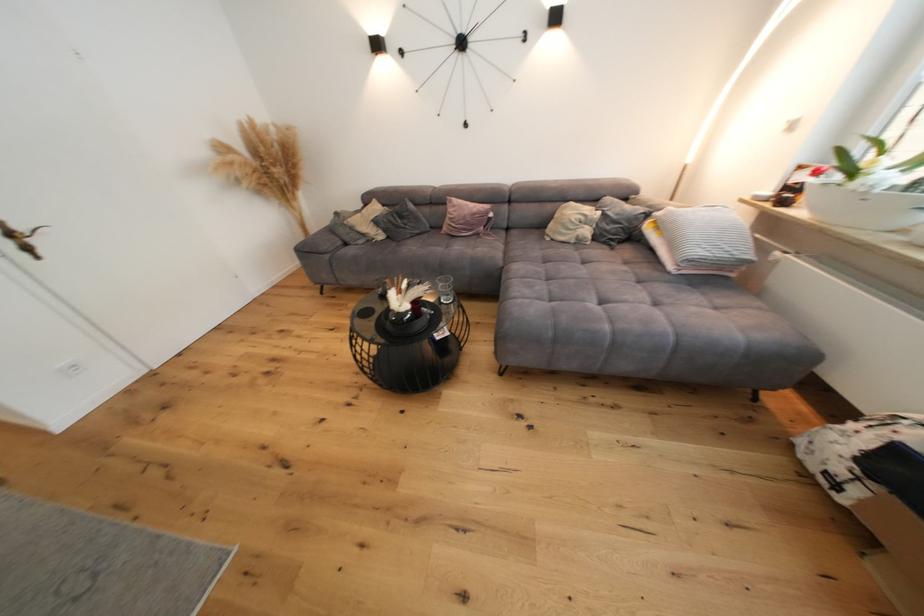
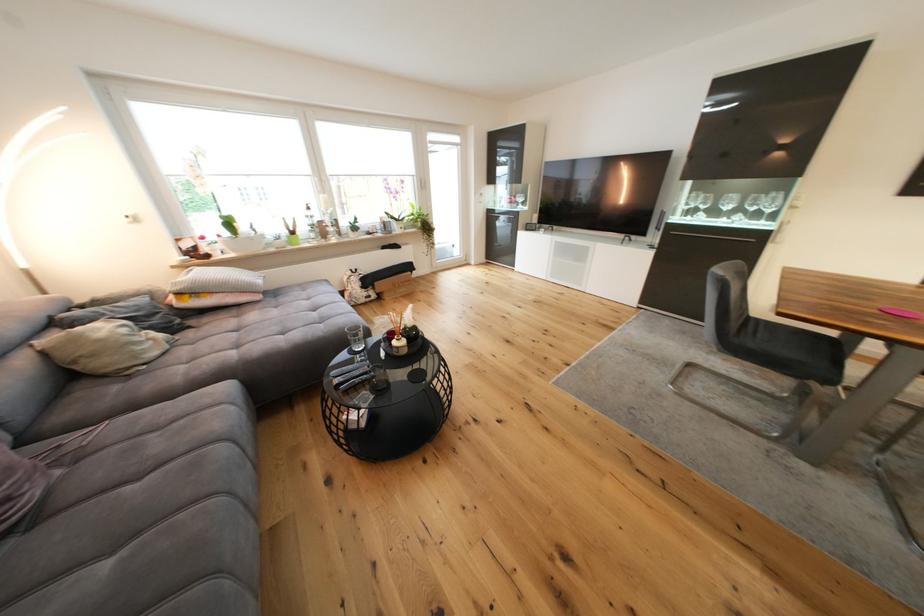
Where in the second image is the point corresponding to point (846, 472) from the first image?

(372, 296)